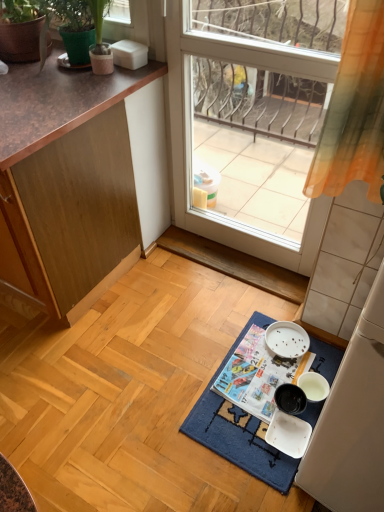
Question: Is printed paper magazine at center wider or thinner than transparent glass door at center?

Choices:
 (A) thin
 (B) wide

Answer: (B)

Question: From the image's perspective, relative to transparent glass door at center, is printed paper magazine at center above or below?

Choices:
 (A) below
 (B) above

Answer: (A)

Question: Which of these objects is positioned farthest from the printed paper magazine at center?

Choices:
 (A) transparent glass door at center
 (B) wooden cabinet at left
 (C) green textured pot at upper left
 (D) white plastic bowl at lower right
 (E) blue woven bath mat at center

Answer: (C)

Question: Estimate the real-world distances between objects in this image. Which object is closer to the wooden cabinet at left?

Choices:
 (A) white plastic bowl at lower right
 (B) green matte flowerpot at upper left
 (C) transparent glass door at center
 (D) printed paper magazine at center
 (E) green textured pot at upper left

Answer: (E)